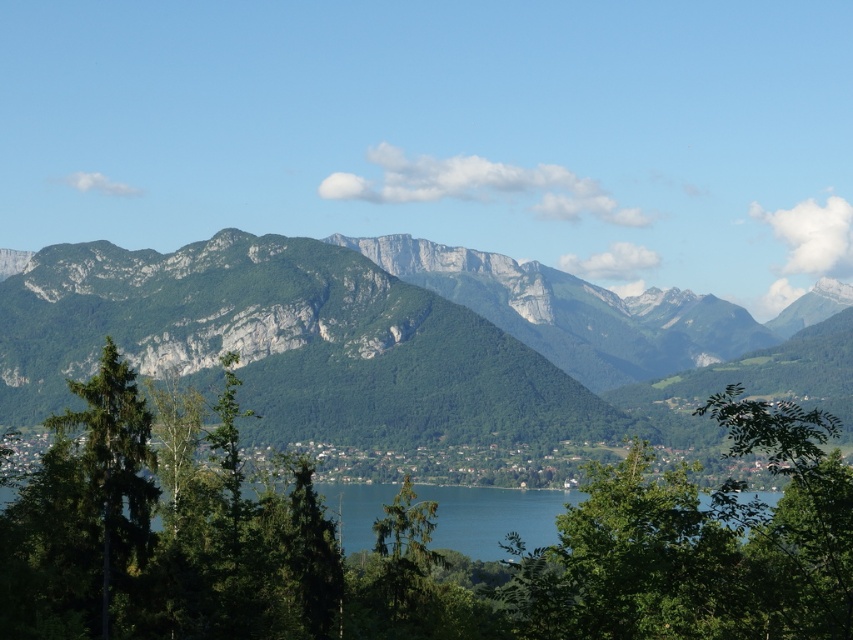
Question: Which point is farther from the camera taking this photo?

Choices:
 (A) [207, 486]
 (B) [224, 531]
 (C) [91, 442]
 (D) [86, 344]

Answer: (D)

Question: Is blue water at center below green matte tree at left?

Choices:
 (A) no
 (B) yes

Answer: (B)

Question: Is green leafy tree at center bigger than green matte tree at left?

Choices:
 (A) no
 (B) yes

Answer: (B)

Question: Does green leafy tree at center appear on the left side of green matte tree at left?

Choices:
 (A) yes
 (B) no

Answer: (B)

Question: Which is nearer to the blue water at center?

Choices:
 (A) green leafy tree at center
 (B) green forested mountain at center

Answer: (A)

Question: Which point is closer to the camera taking this photo?

Choices:
 (A) (576, 291)
 (B) (222, 518)

Answer: (B)